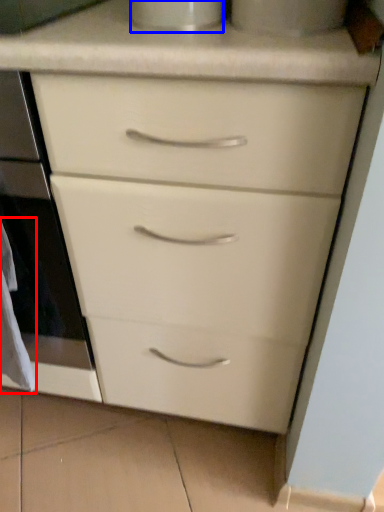
Question: Which of the following is the farthest to the observer, material (highlighted by a red box) or appliance (highlighted by a blue box)?

Choices:
 (A) material
 (B) appliance

Answer: (A)